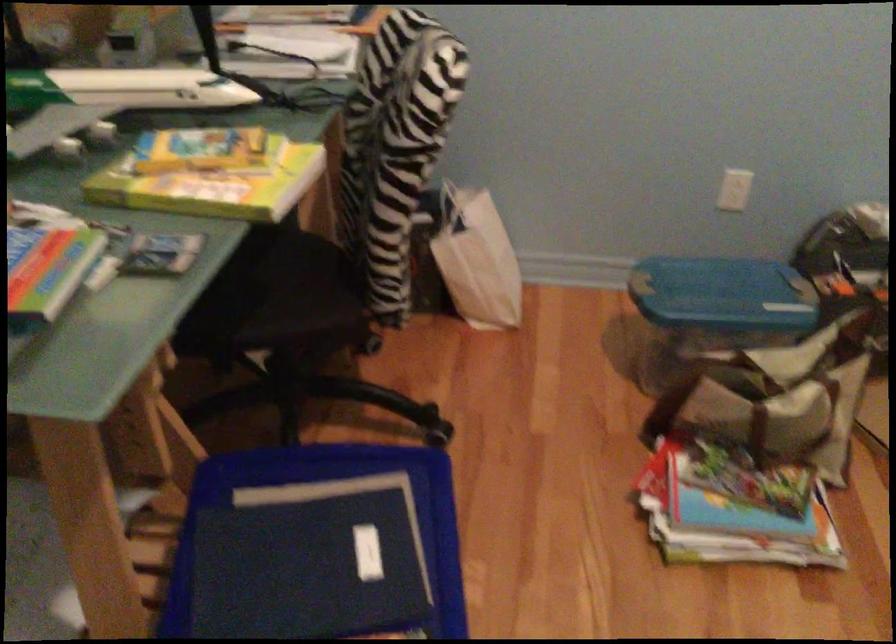
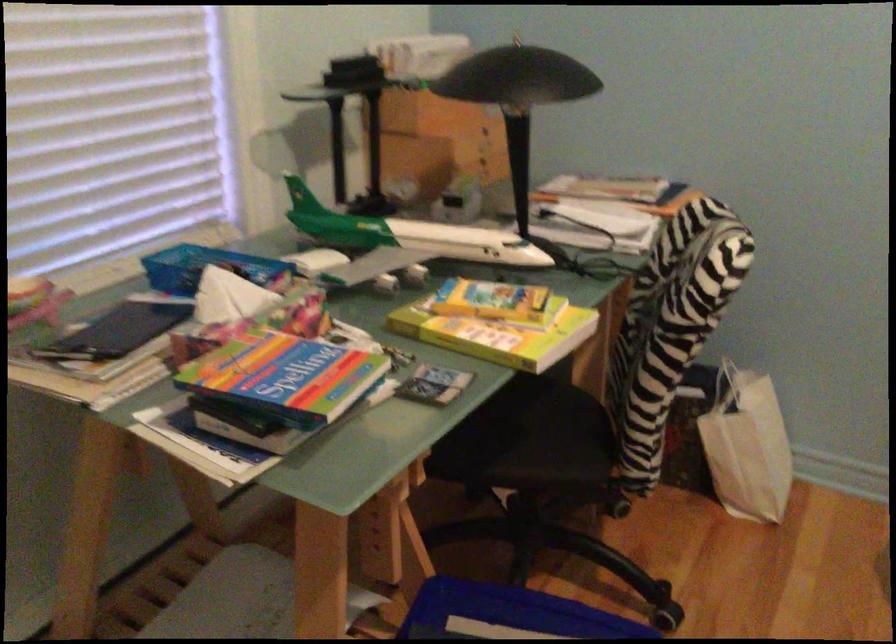
Where in the second image is the point corresponding to (218,185) from the first image?

(497, 330)